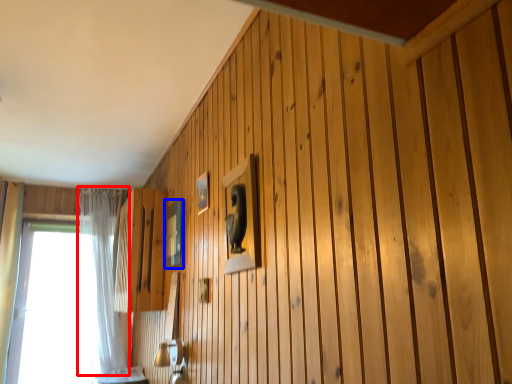
Question: Which point is further to the camera, curtain (highlighted by a red box) or picture frame (highlighted by a blue box)?

Choices:
 (A) curtain
 (B) picture frame

Answer: (A)